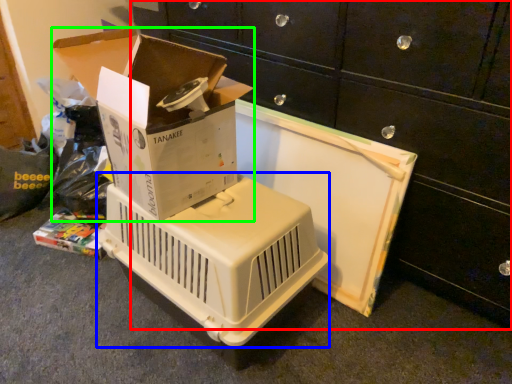
Question: Which object is the farthest from furniture (highlighted by a red box)? Choose among these: appliance (highlighted by a blue box) or box (highlighted by a green box).

Choices:
 (A) appliance
 (B) box

Answer: (A)